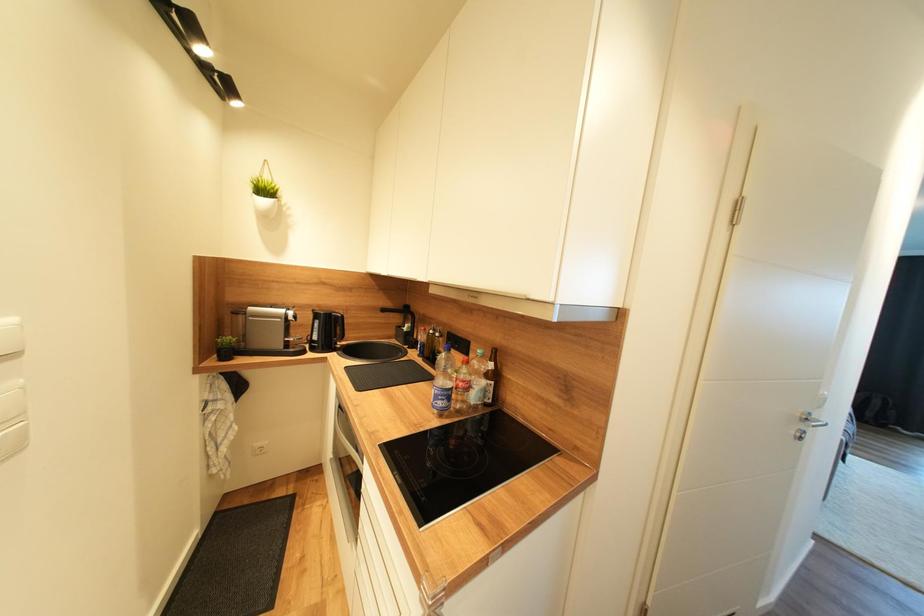
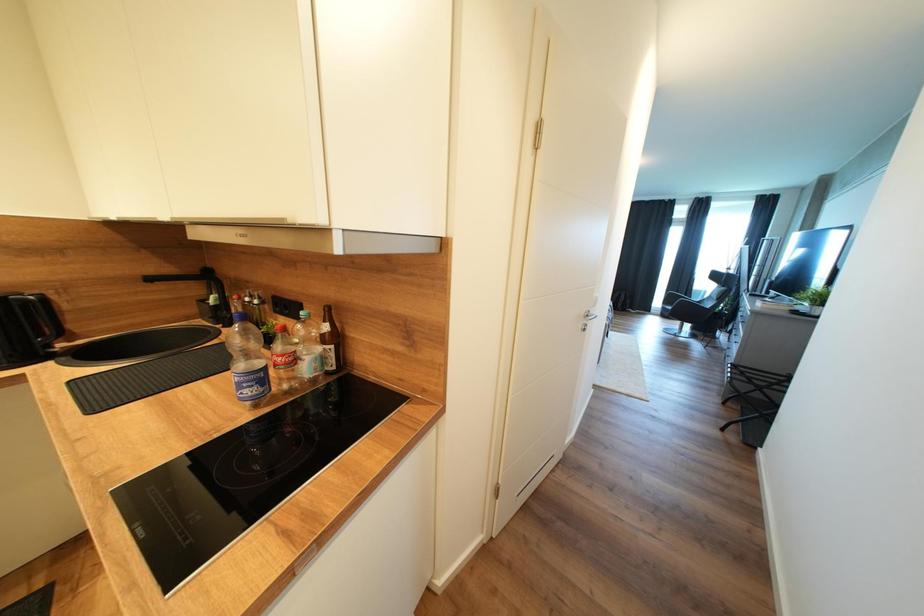
The images are taken continuously from a first-person perspective. In which direction are you moving?

The cameraman moved toward right, forward.